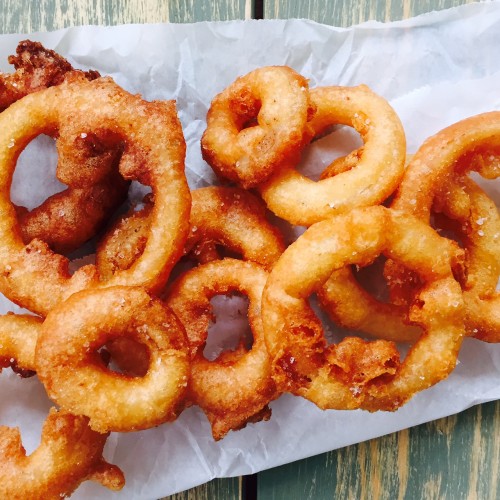
Locate an element on the screen. The height and width of the screenshot is (500, 500). tissue is located at coordinates [x=190, y=45].